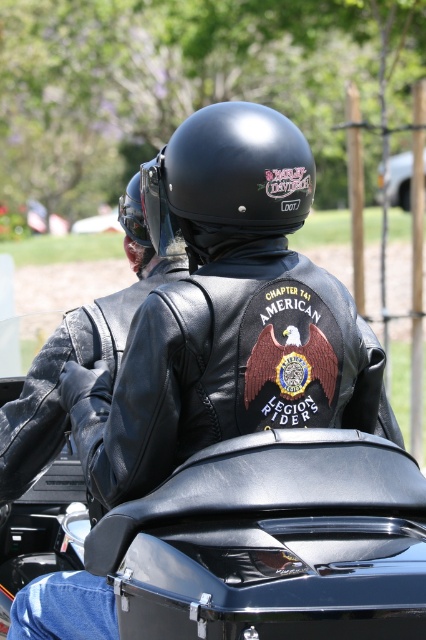
How far apart are black leather jacket at center and matte black helmet at upper center?

A distance of 3.56 feet exists between black leather jacket at center and matte black helmet at upper center.

Consider the image. Measure the distance between point (345, 349) and camera.

A distance of 10.61 feet exists between point (345, 349) and camera.

The height and width of the screenshot is (640, 426). I want to click on black leather jacket at center, so point(233,368).

Can you confirm if black leather motorcycle at center is shorter than matte black helmet at upper center?

In fact, black leather motorcycle at center may be taller than matte black helmet at upper center.

From the picture: Between black leather motorcycle at center and matte black helmet at upper center, which one is positioned higher?

matte black helmet at upper center

Which is behind, point (307, 593) or point (129, 193)?

Point (129, 193)

What are the coordinates of `black leather motorcycle at center` in the screenshot? It's located at (244, 541).

Can you confirm if black matte helmet at center is bigger than matte black helmet at upper center?

Correct, black matte helmet at center is larger in size than matte black helmet at upper center.

Is black matte helmet at center taller than matte black helmet at upper center?

Indeed, black matte helmet at center has a greater height compared to matte black helmet at upper center.

I want to click on black matte helmet at center, so click(x=227, y=180).